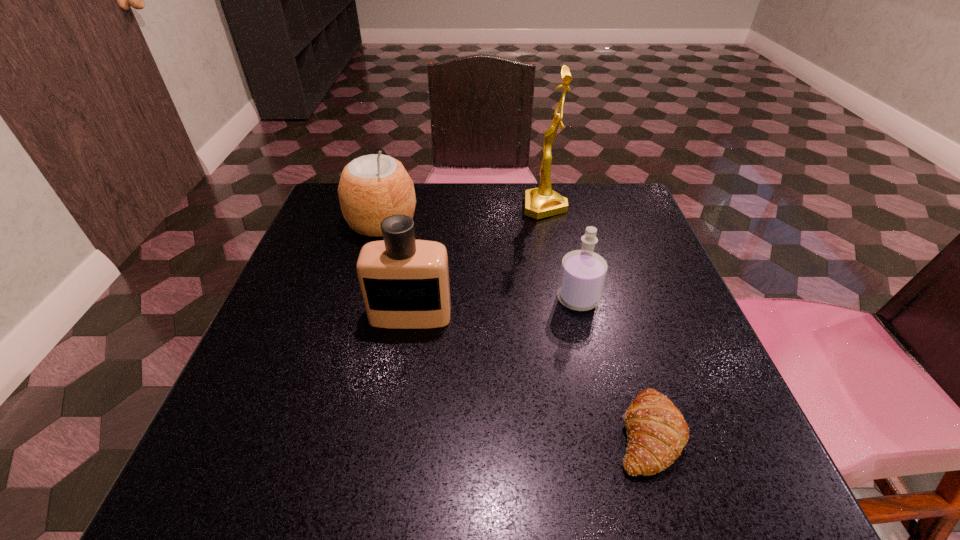
Identify which object is located as the nearest to the award. Please provide its 2D coordinates. Your answer should be formatted as a tuple, i.e. [(x, y)], where the tuple contains the x and y coordinates of a point satisfying the conditions above.

[(583, 272)]

Where is `vacant space that satisfies the following two spatial constraints: 1. on the front label of the taller perfume; 2. on the left side of the crescent roll`? This screenshot has width=960, height=540. vacant space that satisfies the following two spatial constraints: 1. on the front label of the taller perfume; 2. on the left side of the crescent roll is located at coordinates (392, 433).

This screenshot has width=960, height=540. Find the location of `vacant space that satisfies the following two spatial constraints: 1. on the front-facing side of the tallest object; 2. on the left side of the nearest object`. vacant space that satisfies the following two spatial constraints: 1. on the front-facing side of the tallest object; 2. on the left side of the nearest object is located at coordinates (590, 433).

Find the location of a particular element. This screenshot has height=540, width=960. vacant position in the image that satisfies the following two spatial constraints: 1. on the front label of the crescent roll; 2. on the right side of the taller perfume is located at coordinates pyautogui.click(x=392, y=433).

Image resolution: width=960 pixels, height=540 pixels. Find the location of `free space in the image that satisfies the following two spatial constraints: 1. on the front-facing side of the award; 2. on the back side of the second shortest object`. free space in the image that satisfies the following two spatial constraints: 1. on the front-facing side of the award; 2. on the back side of the second shortest object is located at coordinates (564, 299).

At what (x,y) coordinates should I click in order to perform the action: click on blank space that satisfies the following two spatial constraints: 1. on the front label of the taller perfume; 2. on the left side of the crescent roll. Please return your answer as a coordinate pair (x, y). The image size is (960, 540). Looking at the image, I should click on (392, 433).

The height and width of the screenshot is (540, 960). I want to click on vacant space that satisfies the following two spatial constraints: 1. on the front-facing side of the tallest object; 2. on the left side of the right perfume, so click(x=564, y=299).

Find the location of a particular element. free space that satisfies the following two spatial constraints: 1. on the front side of the coconut; 2. on the left side of the shortest object is located at coordinates (323, 433).

This screenshot has height=540, width=960. What are the coordinates of `vacant area that satisfies the following two spatial constraints: 1. on the front-facing side of the shortest object; 2. on the right side of the award` in the screenshot? It's located at (590, 433).

Where is `vacant space that satisfies the following two spatial constraints: 1. on the front-facing side of the tallest object; 2. on the left side of the shorter perfume`? This screenshot has height=540, width=960. vacant space that satisfies the following two spatial constraints: 1. on the front-facing side of the tallest object; 2. on the left side of the shorter perfume is located at coordinates (564, 299).